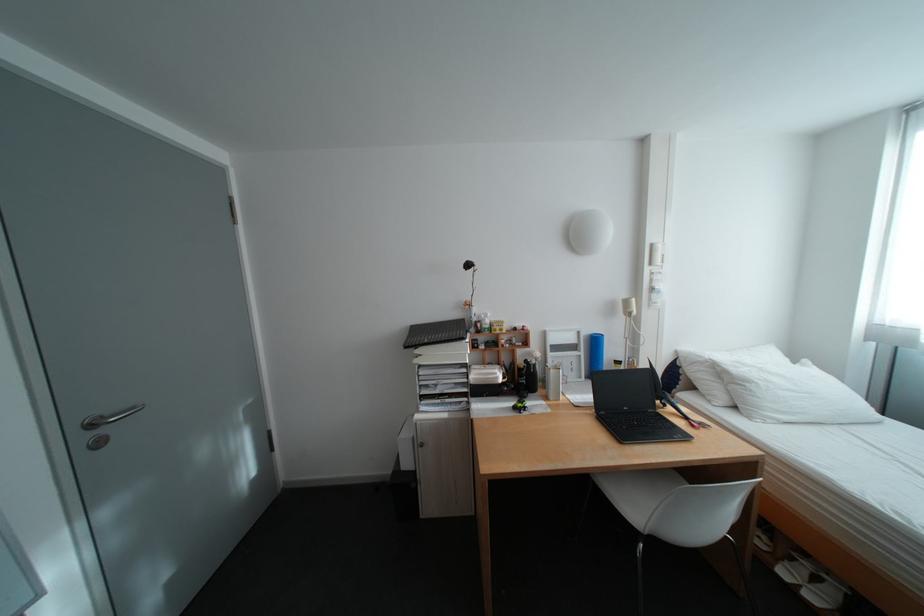
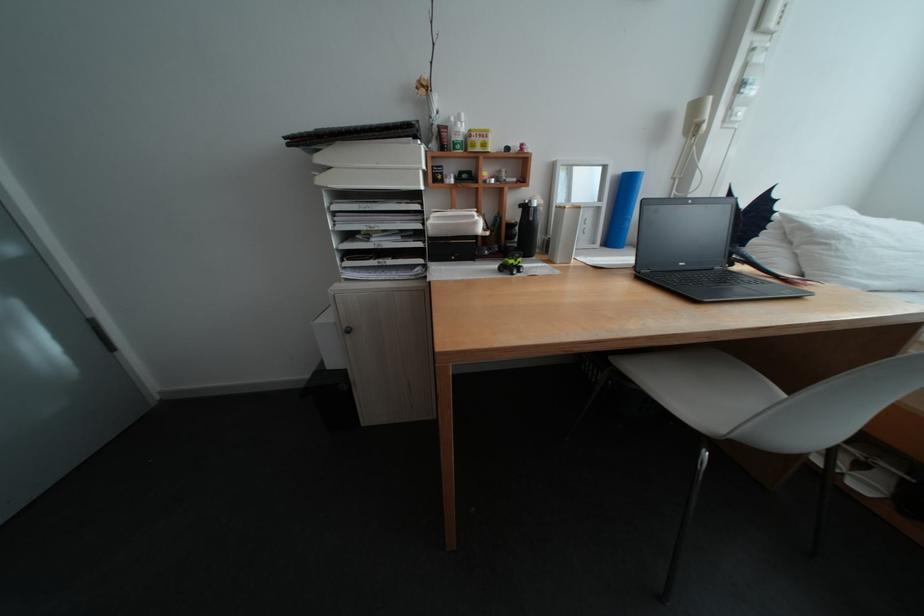
In the second image, find the point that corresponds to pixel 594 354 in the first image.

(616, 205)